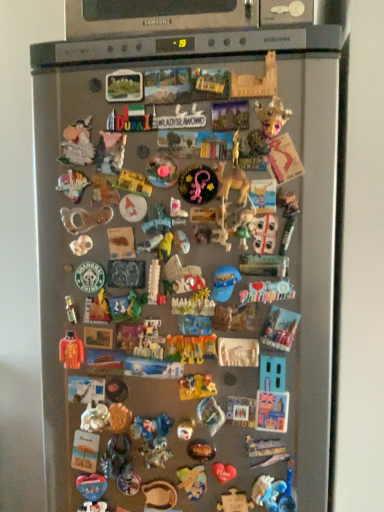
Question: From a real-world perspective, is wooden puzzle piece at center, which is the 15th toy from top to bottom, above or below multicolored plastic toy at upper left, marked as the 27th toy in a bottom-to-top arrangement?

Choices:
 (A) below
 (B) above

Answer: (A)

Question: Do you think wooden puzzle piece at center, acting as the 18th toy starting from the bottom, is within multicolored plastic toy at upper left, marked as the 27th toy in a bottom-to-top arrangement, or outside of it?

Choices:
 (A) outside
 (B) inside

Answer: (A)

Question: Based on their relative distances, which object is farther from the metallic gold statue at center, arranged as the fifteenth toy when ordered from the bottom?

Choices:
 (A) wooden castle at center, which ranks as the 20th toy in top-to-bottom order
 (B) green plastic toy at center, marked as the 21th toy in a bottom-to-top arrangement
 (C) wooden puzzle piece at center, the 32th toy in the top-to-bottom sequence
 (D) matte blue heart at center, which is counted as the 30th toy, starting from the top
 (E) metallic silver opener at center, placed as the 9th toy when sorted from top to bottom

Answer: (C)

Question: Considering the real-world distances, which object is closest to the wooden puzzle piece at center, acting as the 28th toy starting from the top?

Choices:
 (A) blue plastic toy at center, the seventeenth toy in the bottom-to-top sequence
 (B) wooden bowl at lower center, the 2th toy positioned from the bottom
 (C) wooden castle at center, which ranks as the 20th toy in top-to-bottom order
 (D) matte blue heart at center, which is counted as the 30th toy, starting from the top
 (E) green plastic toy at center, marked as the 21th toy in a bottom-to-top arrangement

Answer: (B)